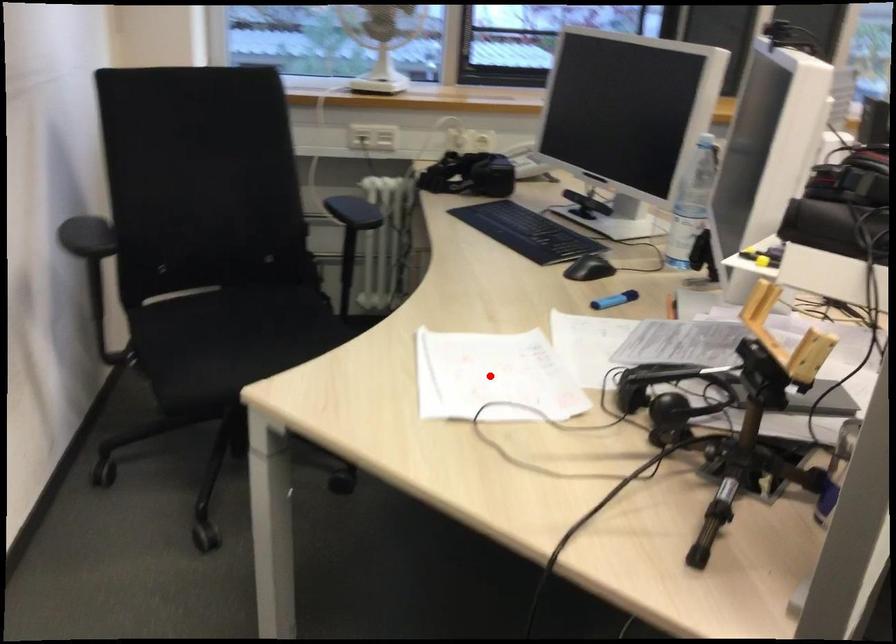
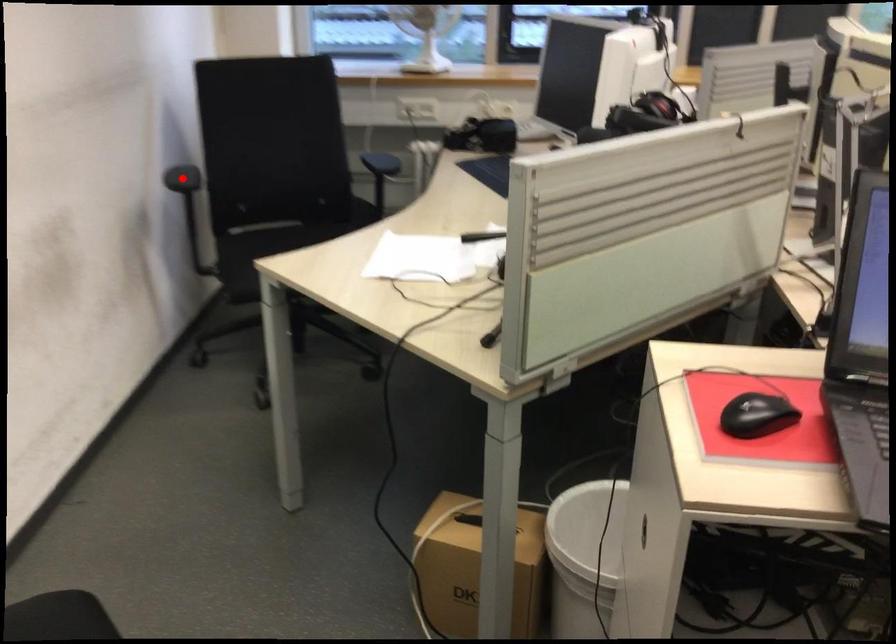
I am providing you with two images of the same scene from different viewpoints. A red point is marked on the first image and another point is marked on the second image. Is the red point in image1 aligned with the point shown in image2?

No